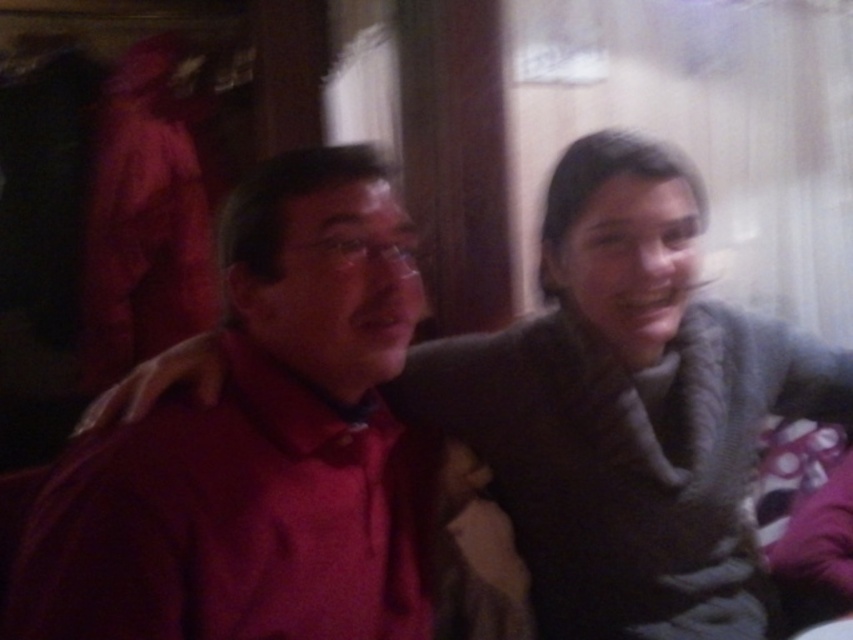
This screenshot has height=640, width=853. Find the location of `matte red shirt at left`. matte red shirt at left is located at coordinates (260, 448).

Is point (100, 451) positioned after point (751, 429)?

No, (100, 451) is closer to viewer.

At what (x,y) coordinates should I click in order to perform the action: click on matte red shirt at left. Please return your answer as a coordinate pair (x, y). Looking at the image, I should click on (260, 448).